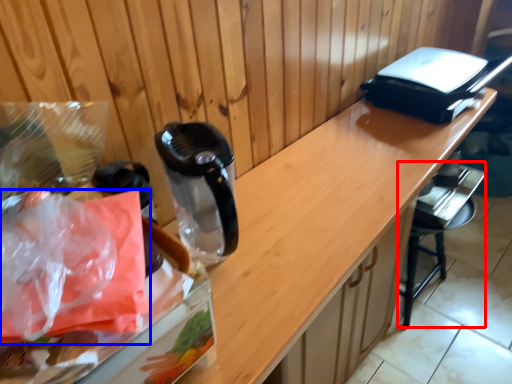
Question: Among these objects, which one is farthest to the camera, bar stool (highlighted by a red box) or plastic bag (highlighted by a blue box)?

Choices:
 (A) bar stool
 (B) plastic bag

Answer: (A)